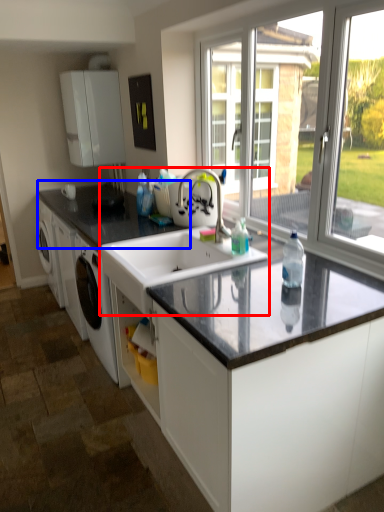
Question: Which point is closer to the camera, sink (highlighted by a red box) or countertop (highlighted by a blue box)?

Choices:
 (A) sink
 (B) countertop

Answer: (A)